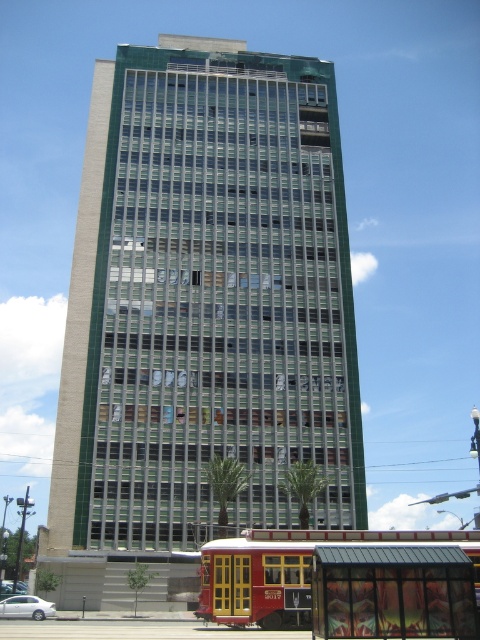
Is point (264, 163) positioned in front of point (448, 596)?

No, (264, 163) is behind (448, 596).

Which is behind, point (186, 192) or point (389, 627)?

The point (186, 192) is more distant.

Find the location of a particular element. The height and width of the screenshot is (640, 480). green glass building at center is located at coordinates (204, 307).

Between metallic glass bus stop at lower center and white matte car at lower left, which one appears on the left side from the viewer's perspective?

white matte car at lower left is more to the left.

Which of these two, metallic glass bus stop at lower center or white matte car at lower left, stands taller?

Standing taller between the two is white matte car at lower left.

Which is behind, point (330, 582) or point (14, 611)?

The point (14, 611) is behind.

Where is `metallic glass bus stop at lower center`? This screenshot has height=640, width=480. metallic glass bus stop at lower center is located at coordinates (393, 593).

Which is below, red polished wood bus at lower center or white matte car at lower left?

Positioned lower is white matte car at lower left.

Between point (276, 624) and point (33, 596), which one is positioned in front?

Point (276, 624) is more forward.

I want to click on red polished wood bus at lower center, so click(x=288, y=572).